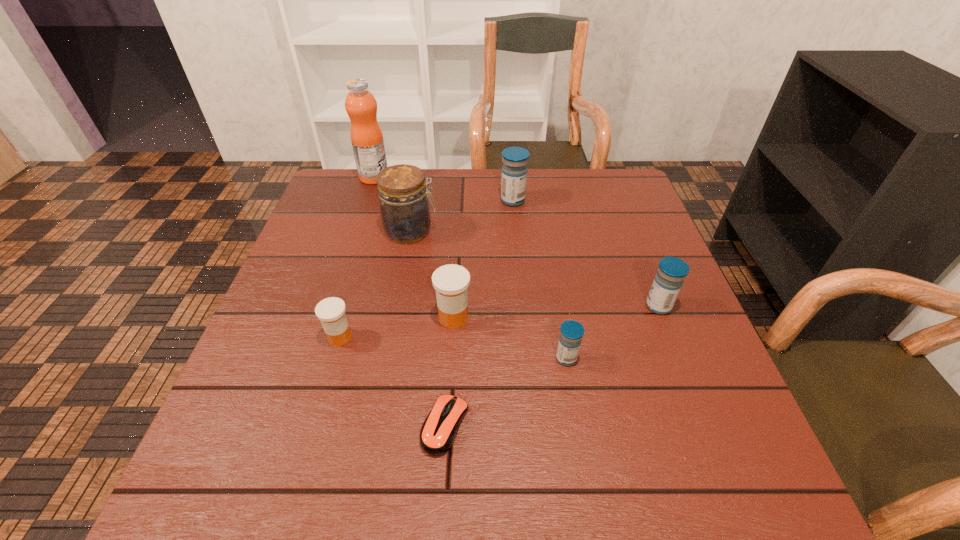
Identify the location of the left orange medicine. (331, 311).

Find the location of a particular element. Image resolution: width=960 pixels, height=540 pixels. the smaller orange medicine is located at coordinates 331,311.

The height and width of the screenshot is (540, 960). In order to click on the second blue medicine from right to left in this screenshot , I will do pyautogui.click(x=571, y=332).

Find the location of `the smallest blue medicine`. the smallest blue medicine is located at coordinates (571, 332).

Find the location of a particular element. The width and height of the screenshot is (960, 540). computer mouse is located at coordinates (438, 432).

This screenshot has width=960, height=540. Identify the location of the shortest object. (438, 432).

I want to click on vacant area located 0.150m on the right of the tallest object, so click(438, 177).

Find the location of a particular element. This screenshot has width=960, height=540. free space located 0.260m on the lid of the jar is located at coordinates (535, 231).

Where is `vacant point located 0.090m on the back of the biggest blue medicine`? This screenshot has width=960, height=540. vacant point located 0.090m on the back of the biggest blue medicine is located at coordinates (511, 177).

Find the location of a particular element. The image size is (960, 540). vacant area situated 0.170m on the label of the second medicine from left to right is located at coordinates (550, 317).